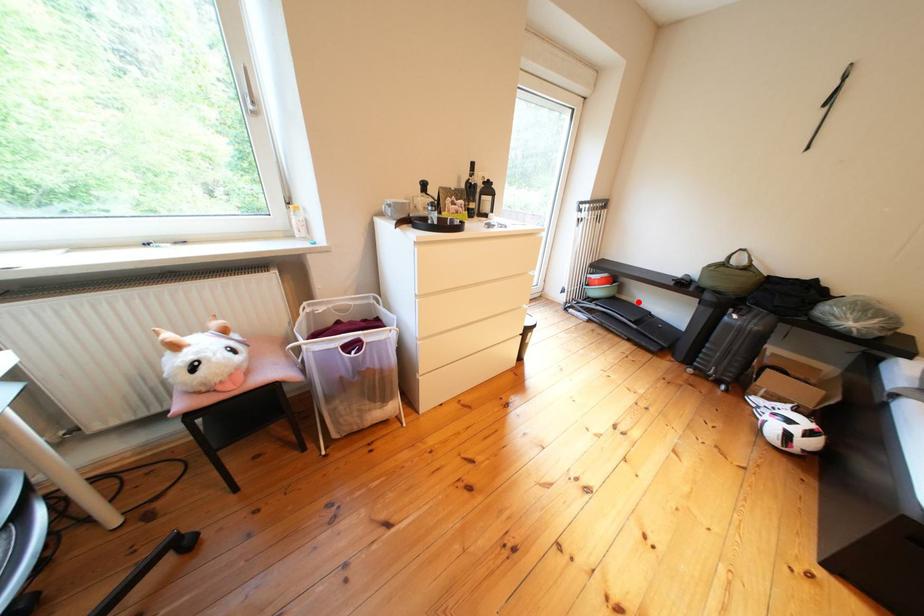
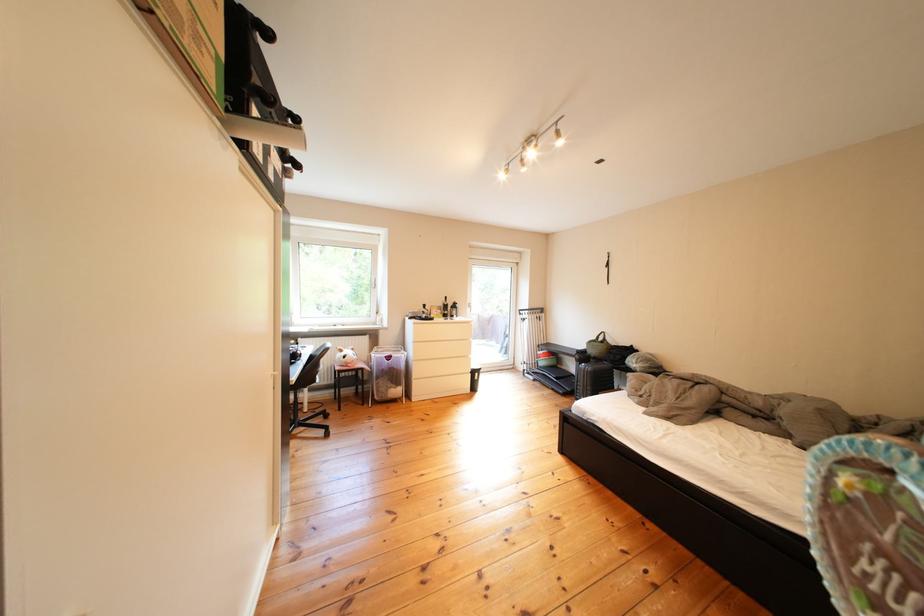
Question: I am providing you with two images of the same scene from different viewpoints. A red point is shown in image1. For the corresponding object point in image2, is it positioned nearer or farther from the camera?

Choices:
 (A) Nearer
 (B) Farther

Answer: (B)